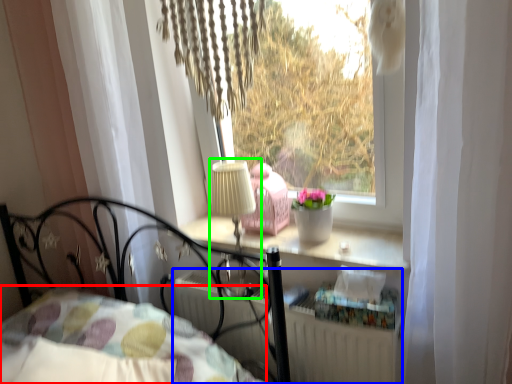
Question: Which is nearer to the bedding (highlighted by a red box)? radiator (highlighted by a blue box) or table lamp (highlighted by a green box).

Choices:
 (A) radiator
 (B) table lamp

Answer: (A)